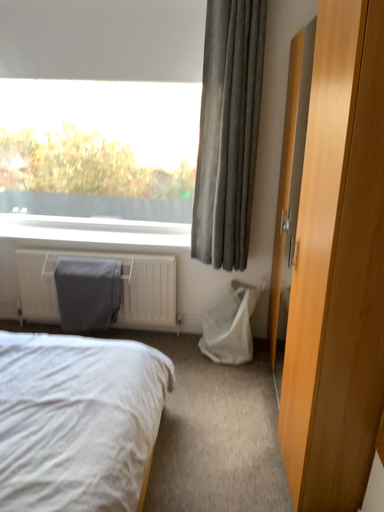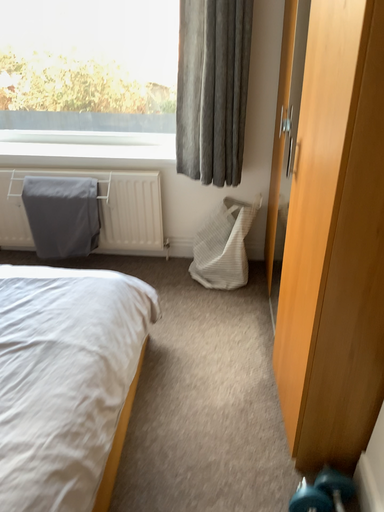
Question: Which way did the camera rotate in the video?

Choices:
 (A) rotated downward
 (B) rotated upward

Answer: (A)